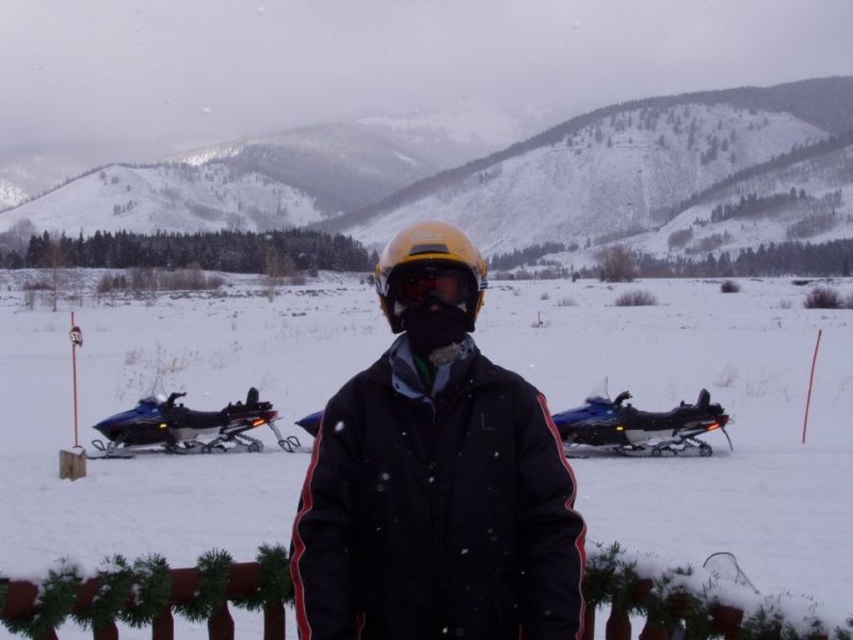
You are a photographer trying to capture the snowmobiles in the midground while standing on the white fluffy snow at center. To ensure the matte yellow goggles at center are not in the shot, should you move forward or backward?

Since the white fluffy snow at center is in front of the matte yellow goggles at center, moving backward would position you further away from the goggles, potentially removing them from the frame while keeping the snowmobiles visible in the midground.